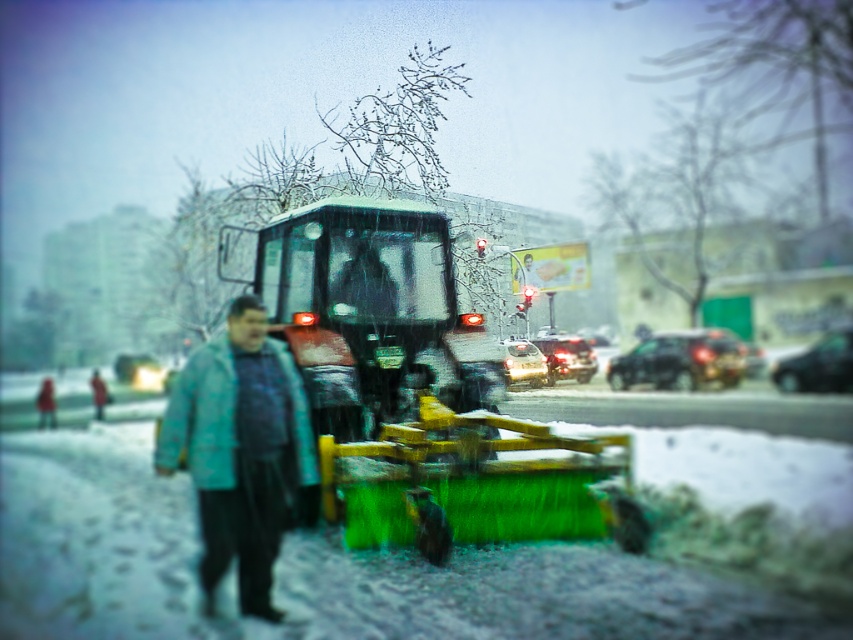
You are a delivery drone flying over the snowy road. You need to land at one of the two points marked in the scene. The first point is at coordinates point (195, 458) and the second is at point (96, 404). Which point is closer to you as you approach from above?

Point (195, 458) is closer to the viewer than point (96, 404), so you should land there first as it is nearer to your current position above the scene.

In the scene shown: You are a delivery drone flying over the snowy road. You need to deliver a package to the teal fabric jacket at center. What is the exact 2D coordinate where you should drop the package?

The exact 2D coordinate for the teal fabric jacket at center is point (241, 449), so you should drop the package there.